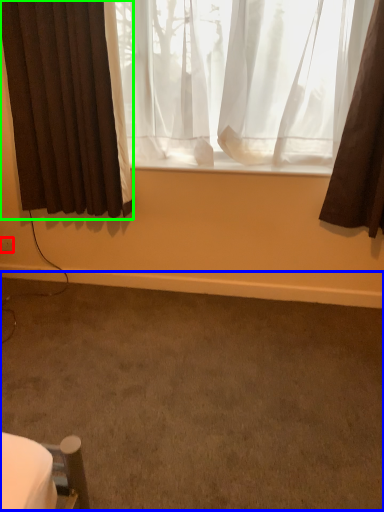
Question: Considering the real-world distances, which object is closest to electric outlet (highlighted by a red box)? plain (highlighted by a blue box) or curtain (highlighted by a green box).

Choices:
 (A) plain
 (B) curtain

Answer: (B)